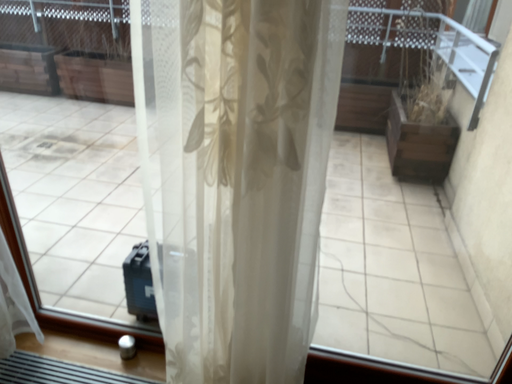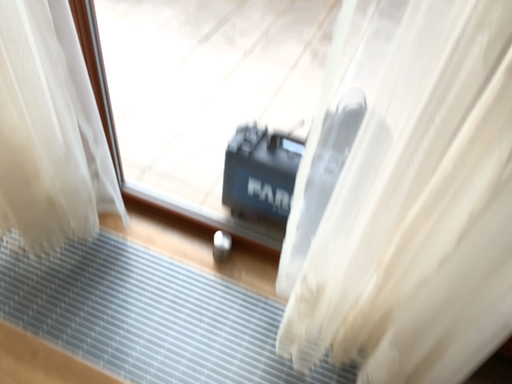
Question: How did the camera likely rotate when shooting the video?

Choices:
 (A) rotated upward
 (B) rotated downward

Answer: (B)